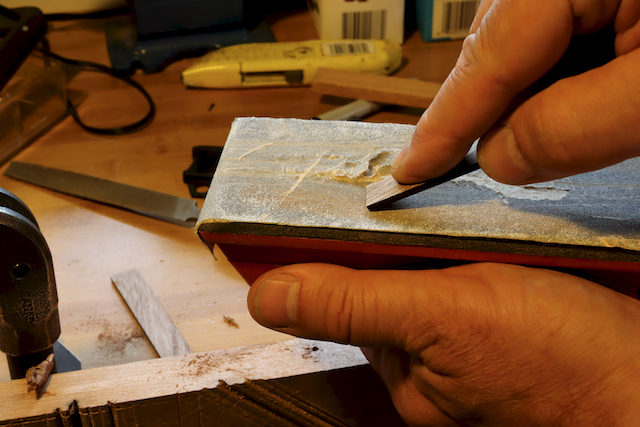
This screenshot has width=640, height=427. Find the location of `table`. table is located at coordinates (141, 159).